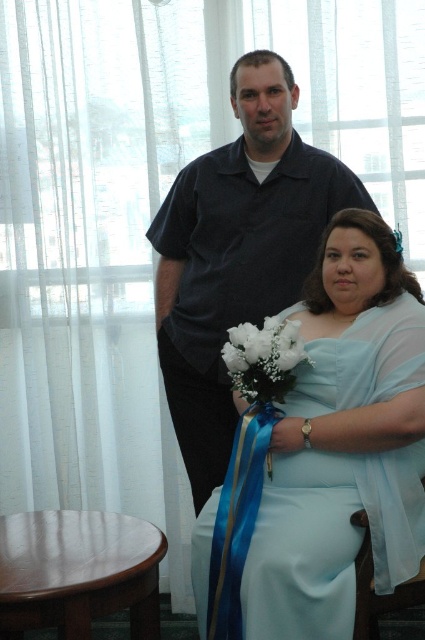
Question: Can you confirm if blue satin ribbon at lower center is positioned below white silk bouquet at lower center?

Choices:
 (A) yes
 (B) no

Answer: (A)

Question: Which object is closer to the camera taking this photo?

Choices:
 (A) light blue satin dress at lower center
 (B) brown wooden stool at lower left

Answer: (B)

Question: Among these points, which one is nearest to the camera?

Choices:
 (A) (110, 595)
 (B) (289, 568)

Answer: (B)

Question: Is brown wooden stool at lower left below blue satin ribbon at lower center?

Choices:
 (A) no
 (B) yes

Answer: (B)

Question: Is light blue satin dress at lower center wider than brown wooden stool at lower left?

Choices:
 (A) yes
 (B) no

Answer: (A)

Question: Which point appears farthest from the camera in this image?

Choices:
 (A) (311, 600)
 (B) (266, 374)
 (C) (226, 541)
 (D) (197, 163)

Answer: (D)